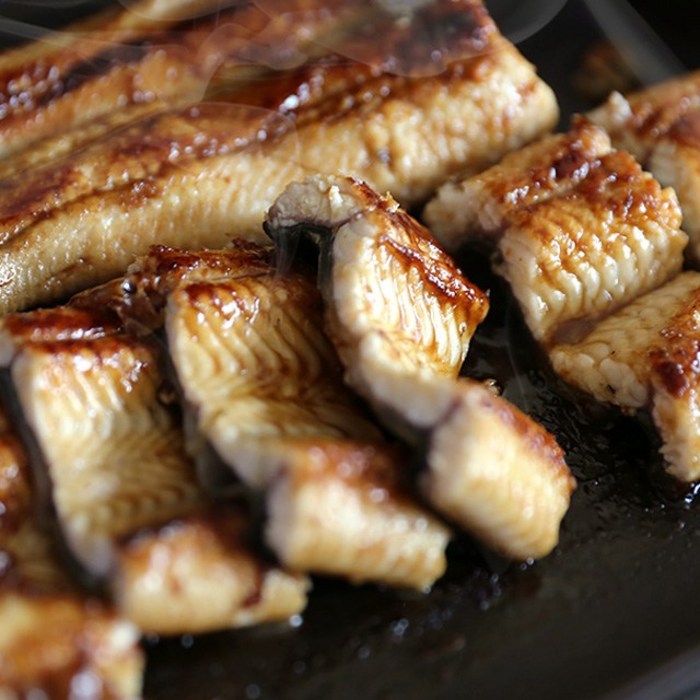
The image size is (700, 700). In order to click on light reflections in this screenshot , I will do `click(125, 630)`, `click(155, 567)`, `click(90, 360)`, `click(223, 302)`, `click(386, 298)`, `click(584, 264)`, `click(110, 218)`.